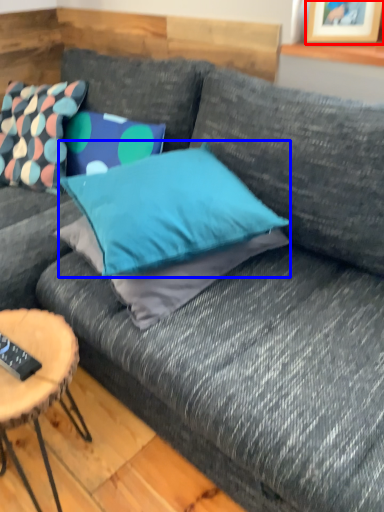
Question: Which object appears closest to the camera in this image, picture frame (highlighted by a red box) or pillow (highlighted by a blue box)?

Choices:
 (A) picture frame
 (B) pillow

Answer: (B)